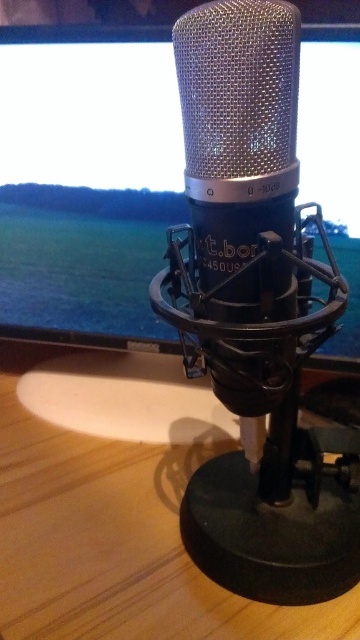
You are setting up a video call and need to position your camera so that both the matte black monitor at center and the wooden table at center are visible. Which object should you place closer to the camera to ensure both are in frame?

The matte black monitor at center is further to the viewer than the wooden table at center, so you should place the matte black monitor at center closer to the camera to ensure both are visible.

From the picture: You are setting up a home studio and need to place both the matte black monitor at center and the wooden table at center in your room. Based on their sizes, which object should you place first if you want to ensure proper clearance for both?

The matte black monitor at center is taller than the wooden table at center, so you should place the matte black monitor at center first to ensure there is enough space above it for the wooden table at center.

You are setting up a home studio and need to place a keyboard that is 12 inches wide between the matte black monitor at center and the wooden table at center. Is there enough space between them to fit the keyboard?

The matte black monitor at center is 13.06 inches from the wooden table at center, so yes, the keyboard that is 12 inches wide can fit between them since the distance is slightly larger than the keyboard.